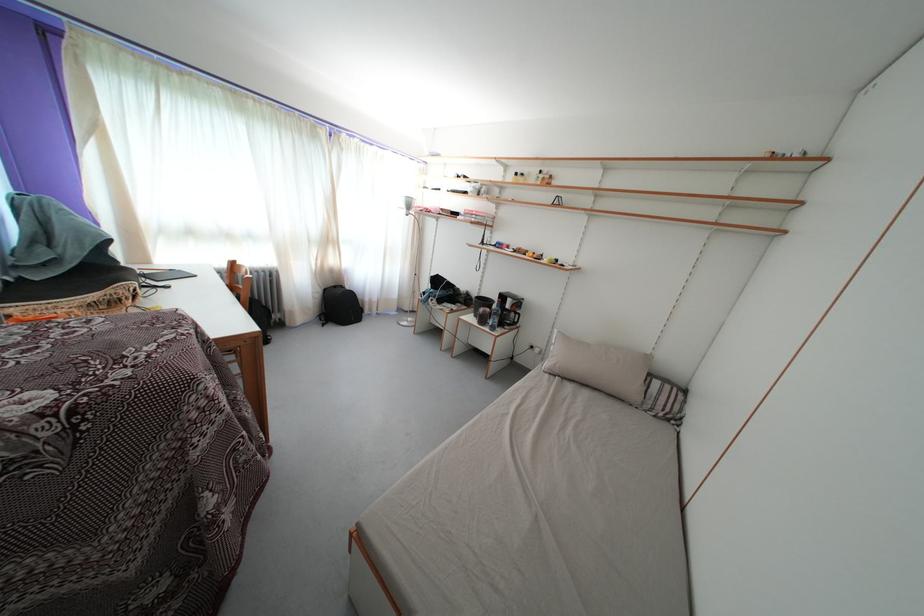
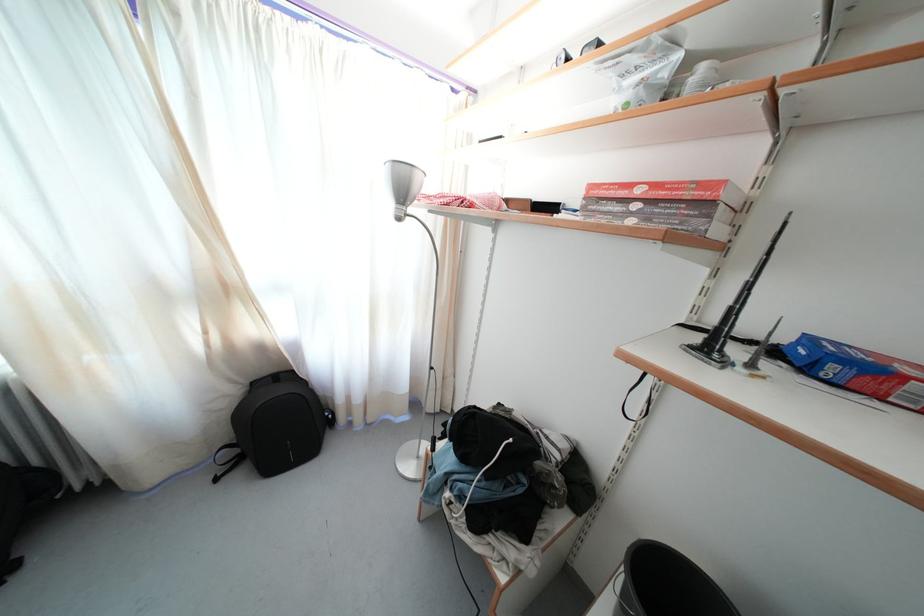
Question: In a continuous first-person perspective shot, in which direction is the camera moving?

Choices:
 (A) Left
 (B) Right
 (C) Forward
 (D) Backward

Answer: (C)